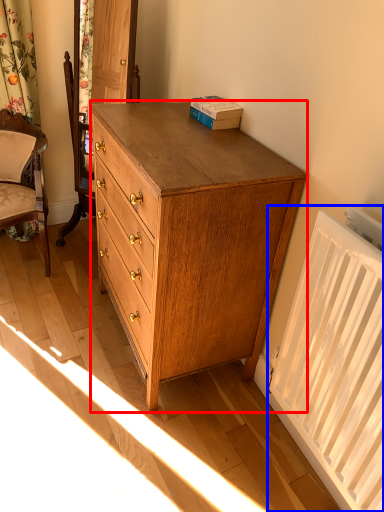
Question: Which point is further to the camera, chest of drawers (highlighted by a red box) or radiator (highlighted by a blue box)?

Choices:
 (A) chest of drawers
 (B) radiator

Answer: (A)